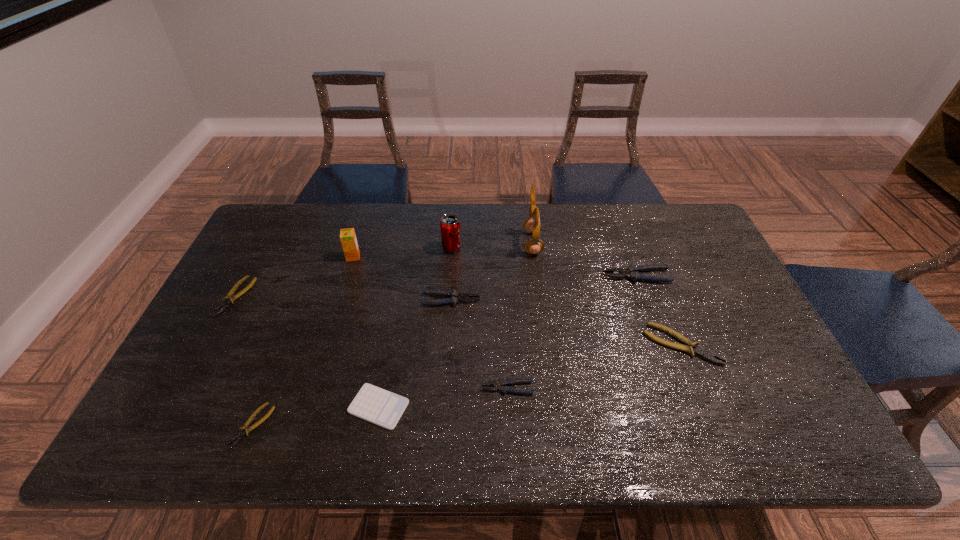
Locate which yellow pliers is the second closest to the fourth farthest pliers. Please provide its 2D coordinates. Your answer should be formatted as a tuple, i.e. [(x, y)], where the tuple contains the x and y coordinates of a point satisfying the conditions above.

[(229, 298)]

Point out which yellow pliers is positioned as the second nearest to the brown earphone. Please provide its 2D coordinates. Your answer should be formatted as a tuple, i.e. [(x, y)], where the tuple contains the x and y coordinates of a point satisfying the conditions above.

[(245, 429)]

Identify the location of vacant area that satisfies the following two spatial constraints: 1. on the back side of the orange juice; 2. on the left side of the red soda can. The width and height of the screenshot is (960, 540). (356, 248).

Identify the location of free location that satisfies the following two spatial constraints: 1. at the gripping part of the second smallest gray pliers; 2. on the front side of the smallest yellow pliers. (444, 426).

Locate an element on the screen. The height and width of the screenshot is (540, 960). vacant space that satisfies the following two spatial constraints: 1. on the front-facing side of the eighth object from left to right; 2. on the right side of the rightmost yellow pliers is located at coordinates (545, 345).